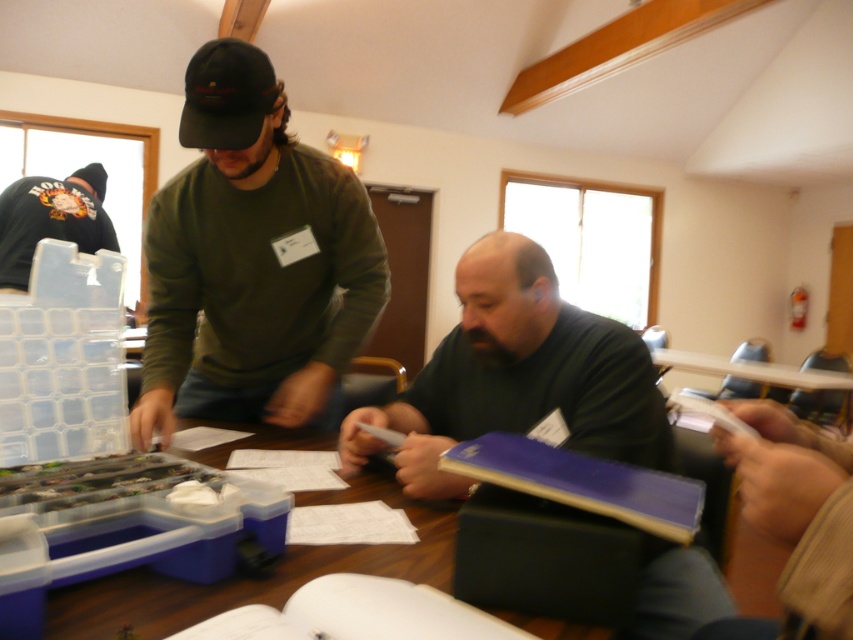
You are standing in the room and want to place a small object on the wooden table at center. Based on the coordinates provided, where should you aim to place the object?

You should aim for the coordinates point (260, 579) to place the small object on the wooden table at center.

You are a guest at this event and want to find the person wearing the dark green hoodie at upper left. Where should you look relative to the black fabric baseball cap at upper center?

The dark green hoodie at upper left is above the black fabric baseball cap at upper center, so you should look upward from the black fabric baseball cap at upper center to find the dark green hoodie at upper left.